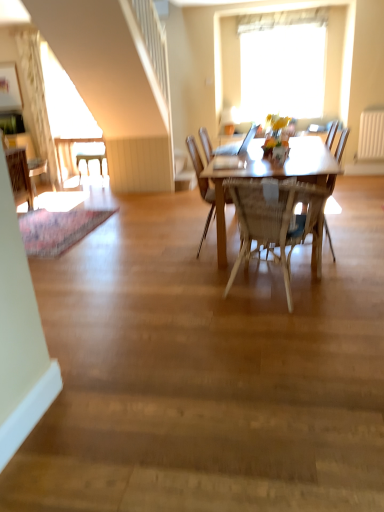
I want to click on vacant area located to the right-hand side of woven wood chair at center, the 2th chair viewed from the right, so click(357, 281).